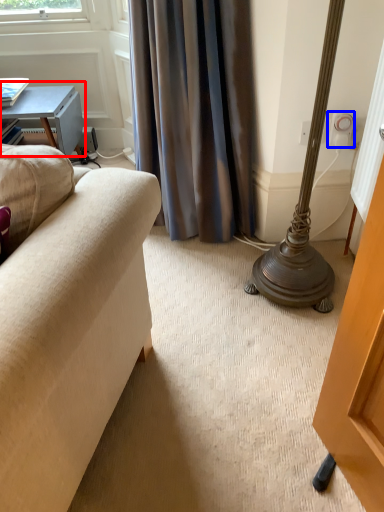
Question: Among these objects, which one is farthest to the camera, table (highlighted by a red box) or electric outlet (highlighted by a blue box)?

Choices:
 (A) table
 (B) electric outlet

Answer: (A)